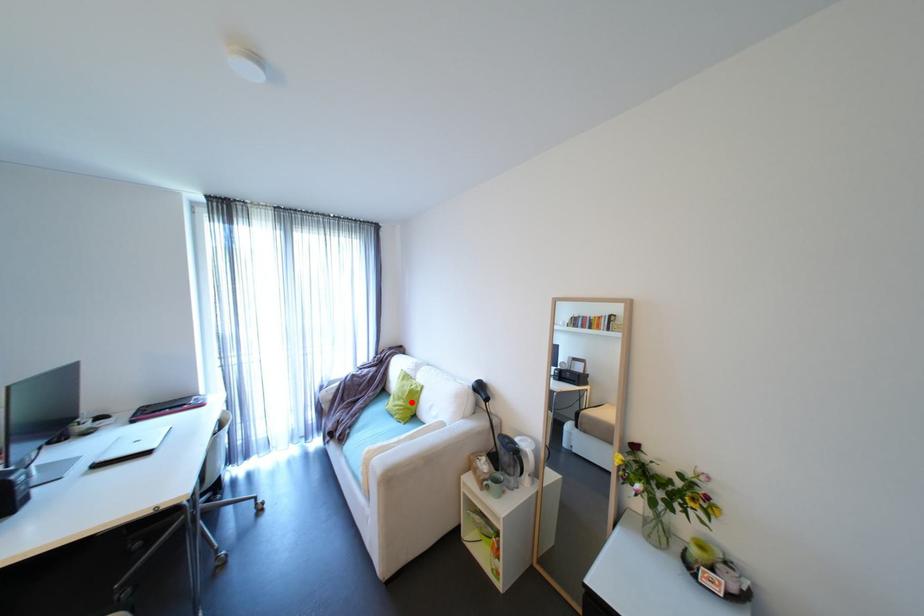
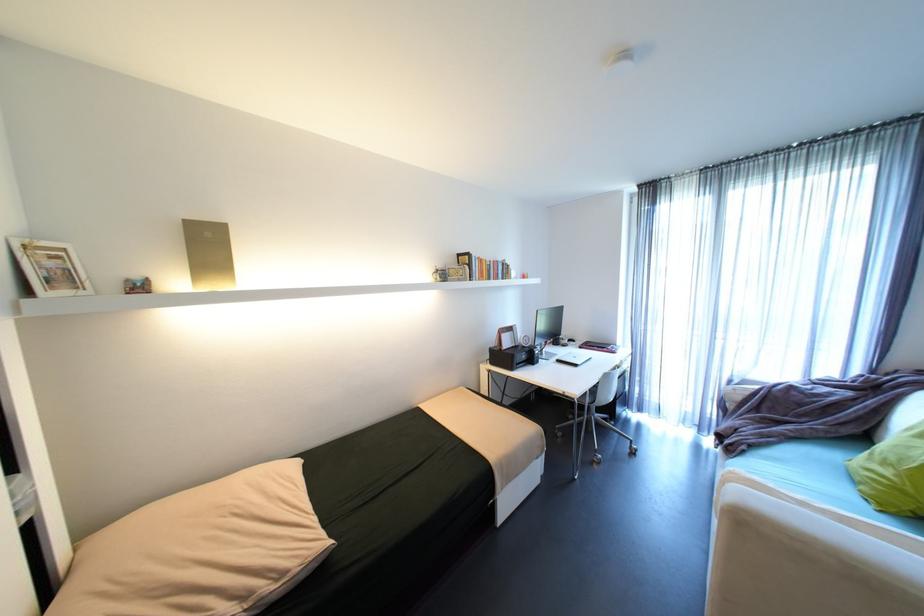
In the second image, find the point that corresponds to the highlighted location in the first image.

(906, 476)